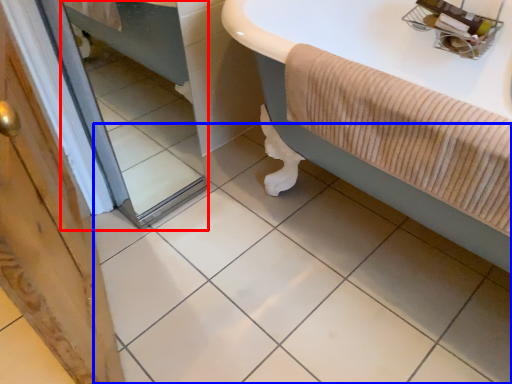
Question: Which of the following is the farthest to the observer, mirror (highlighted by a red box) or ceramic tile (highlighted by a blue box)?

Choices:
 (A) mirror
 (B) ceramic tile

Answer: (A)